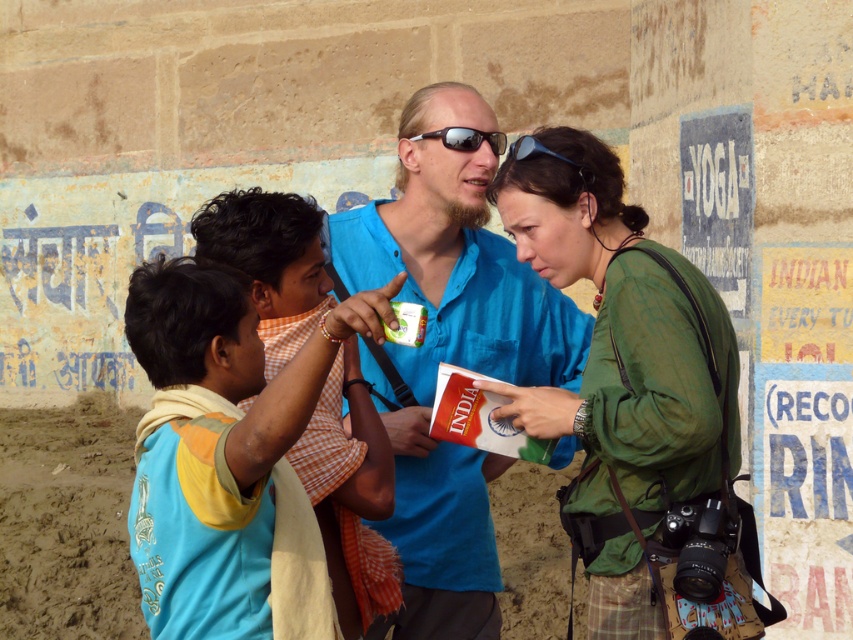
Does blue cotton shirt at center have a greater height compared to green fabric shirt at center?

Indeed, blue cotton shirt at center has a greater height compared to green fabric shirt at center.

Can you confirm if blue cotton shirt at center is positioned below green fabric shirt at center?

Incorrect, blue cotton shirt at center is not positioned below green fabric shirt at center.

Is point (463, 243) farther from viewer compared to point (689, 339)?

That is True.

Find the location of a particular element. blue cotton shirt at center is located at coordinates (448, 356).

Can you confirm if blue cotton shirt at lower left is wider than sunglasses at center?

Correct, the width of blue cotton shirt at lower left exceeds that of sunglasses at center.

Is blue cotton shirt at lower left above sunglasses at center?

Actually, blue cotton shirt at lower left is below sunglasses at center.

Is point (149, 538) positioned before point (476, 134)?

Yes, it is.

Where is `blue cotton shirt at lower left`? blue cotton shirt at lower left is located at coordinates (213, 444).

Who is lower down, green fabric shirt at center or blue cotton shirt at lower left?

blue cotton shirt at lower left is lower down.

Can you confirm if green fabric shirt at center is thinner than blue cotton shirt at lower left?

No.

The height and width of the screenshot is (640, 853). Describe the element at coordinates (619, 368) in the screenshot. I see `green fabric shirt at center` at that location.

Identify the location of green fabric shirt at center. (619, 368).